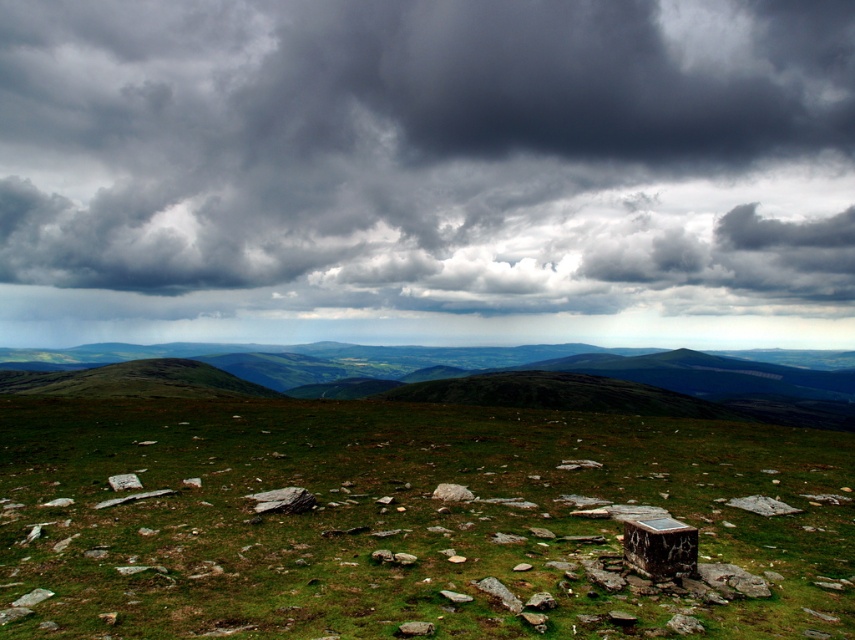
Does dark gray cloud at upper center have a larger size compared to gray stone at lower right?

Indeed, dark gray cloud at upper center has a larger size compared to gray stone at lower right.

Is dark gray cloud at upper center closer to camera compared to gray stone at lower right?

No, dark gray cloud at upper center is further to the viewer.

I want to click on dark gray cloud at upper center, so click(x=425, y=160).

Consider the image. Who is higher up, gray stone at lower right or gray rock at lower center?

gray rock at lower center is above.

This screenshot has width=855, height=640. What do you see at coordinates (761, 506) in the screenshot? I see `gray stone at lower right` at bounding box center [761, 506].

Where is `gray stone at lower right`? Image resolution: width=855 pixels, height=640 pixels. gray stone at lower right is located at coordinates (761, 506).

Is dark gray cloud at upper center in front of gray rock at lower center?

That is False.

I want to click on dark gray cloud at upper center, so click(425, 160).